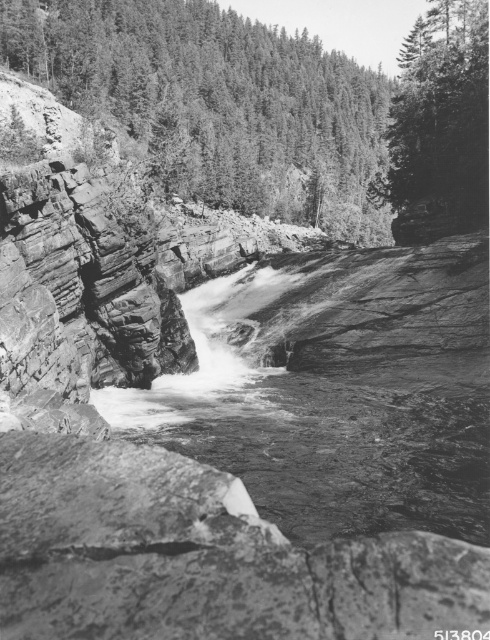
You are a hiker planning to cross the river using a small boat. The boat can only carry you and your gear if the distance between the smooth rock water at center and the dark green textured tree at upper center is at least 150 meters. Based on the scene, can you safely cross the river?

The smooth rock water at center and the dark green textured tree at upper center are 152.10 meters apart, which is more than the required 150 meters. Therefore, the boat can safely carry you and your gear across the river.

You are standing at the edge of the river in the canyon and want to reach the smooth green tree at upper right. Which direction should you move relative to the smooth rock water at center?

You should move upward from the smooth rock water at center to reach the smooth green tree at upper right since the smooth green tree at upper right is located above the smooth rock water at center.